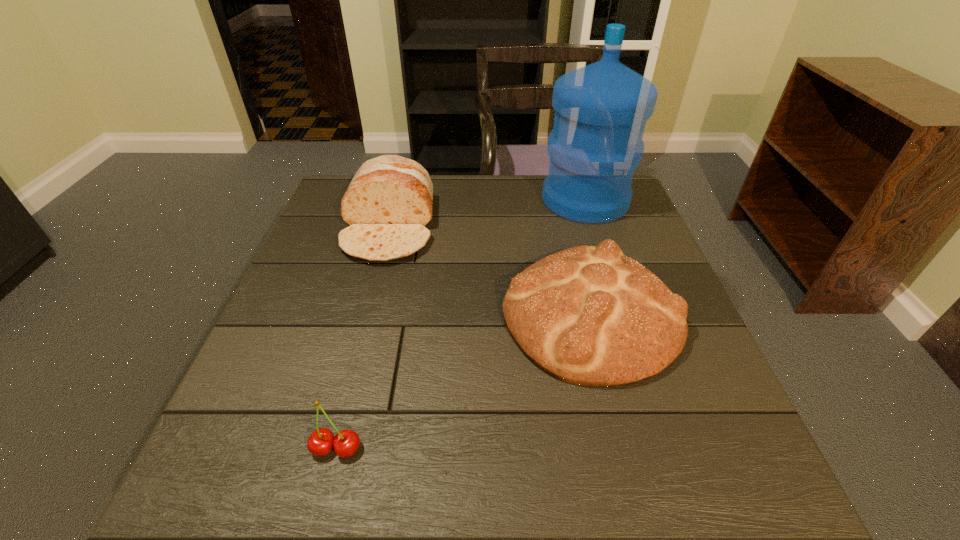
Where is `free spot at the near right corner of the desktop`? free spot at the near right corner of the desktop is located at coordinates (689, 483).

Where is `vacant space in between the right bread and the nearest object`? Image resolution: width=960 pixels, height=540 pixels. vacant space in between the right bread and the nearest object is located at coordinates (463, 381).

At what (x,y) coordinates should I click in order to perform the action: click on free spot between the cherry and the right bread. Please return your answer as a coordinate pair (x, y). The height and width of the screenshot is (540, 960). Looking at the image, I should click on (463, 381).

What are the coordinates of `free spot between the cherry and the right bread` in the screenshot? It's located at (463, 381).

I want to click on free spot between the left bread and the right bread, so click(x=489, y=271).

At what (x,y) coordinates should I click in order to perform the action: click on blank region between the tallest object and the left bread. Please return your answer as a coordinate pair (x, y). Looking at the image, I should click on (487, 214).

Find the location of `unoccupied area between the right bread and the left bread`. unoccupied area between the right bread and the left bread is located at coordinates (489, 271).

Image resolution: width=960 pixels, height=540 pixels. What are the coordinates of `unoccupied area between the left bread and the cherry` in the screenshot? It's located at (363, 338).

This screenshot has width=960, height=540. I want to click on object that stands as the third closest to the left bread, so click(x=346, y=442).

Where is `object that is the second closest to the right bread`? object that is the second closest to the right bread is located at coordinates (388, 203).